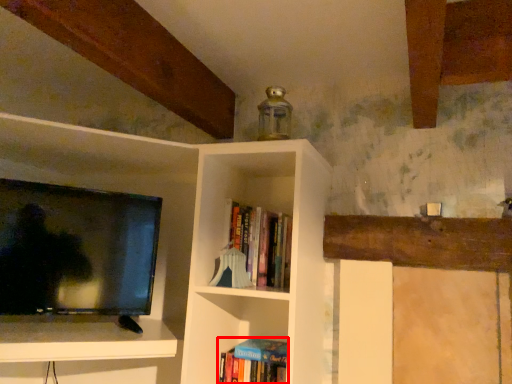
Question: In this image, where is book (annotated by the red box) located relative to book?

Choices:
 (A) right
 (B) left

Answer: (B)